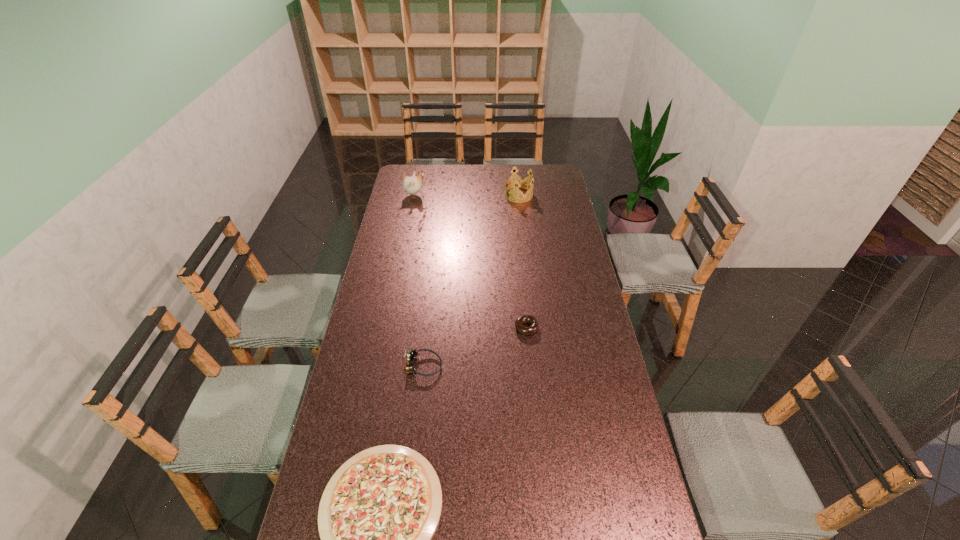
Identify the location of object that is at the far edge. (412, 185).

In order to click on object that is at the left edge in this screenshot , I will do `click(412, 185)`.

Where is `object that is at the far left corner`? The width and height of the screenshot is (960, 540). object that is at the far left corner is located at coordinates click(412, 185).

Where is `vacant region at the far edge`? The image size is (960, 540). vacant region at the far edge is located at coordinates (468, 174).

In the image, there is a desktop. Identify the location of vacant space at the left edge. (349, 437).

You are a GUI agent. You are given a task and a screenshot of the screen. Output one action in this format:
    pyautogui.click(x=<x>, y=<y>)
    Task: Click on the vacant space at the right edge of the desktop
    This screenshot has height=540, width=960.
    Given the screenshot: What is the action you would take?
    click(554, 214)

In the image, there is a desktop. Identify the location of vacant region at the far right corner. Image resolution: width=960 pixels, height=540 pixels. (557, 177).

The image size is (960, 540). What are the coordinates of `vacant area that lies between the tallest object and the second shortest object` in the screenshot? It's located at (470, 261).

Where is `free area in between the third shortest object and the crown`? Image resolution: width=960 pixels, height=540 pixels. free area in between the third shortest object and the crown is located at coordinates (471, 280).

At what (x,y) coordinates should I click in order to perform the action: click on unoccupied position between the fourth tallest object and the third tallest object. Please return your answer as a coordinate pair (x, y). The height and width of the screenshot is (540, 960). Looking at the image, I should click on (475, 347).